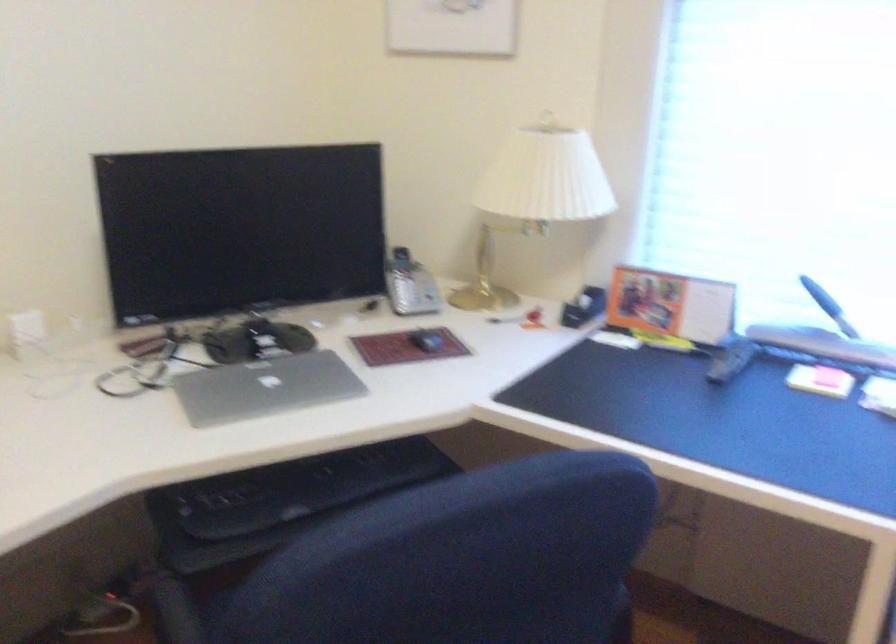
Where is `black pen`? The height and width of the screenshot is (644, 896). black pen is located at coordinates (504, 319).